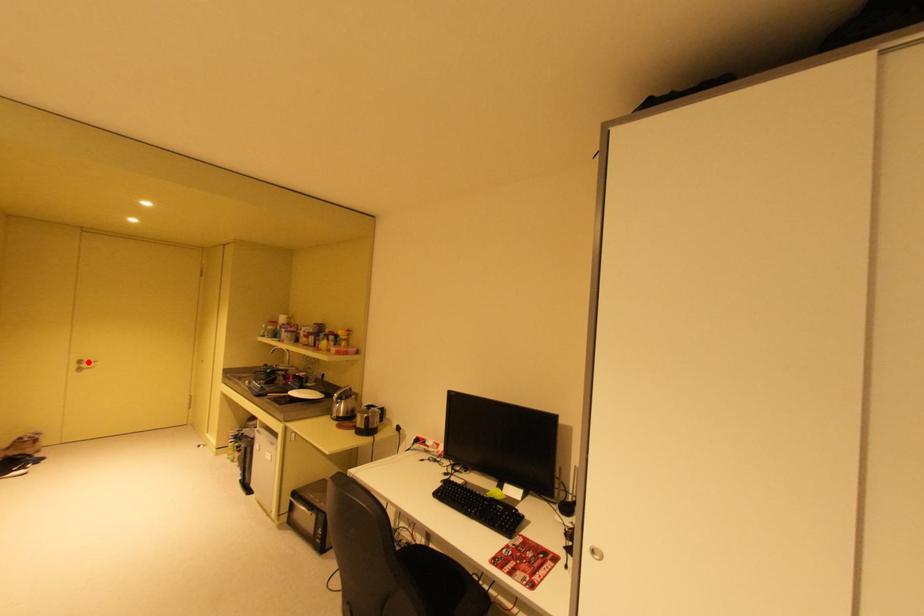
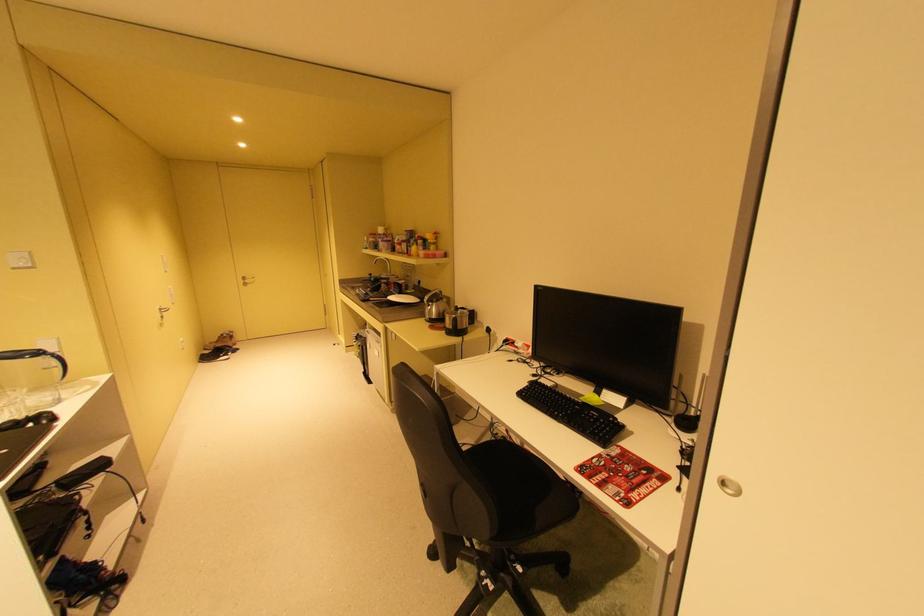
Question: I am providing you with two images of the same scene from different viewpoints. A red point is marked on the first image. Is the red point's position out of view in image 2?

Choices:
 (A) Yes
 (B) No

Answer: (B)